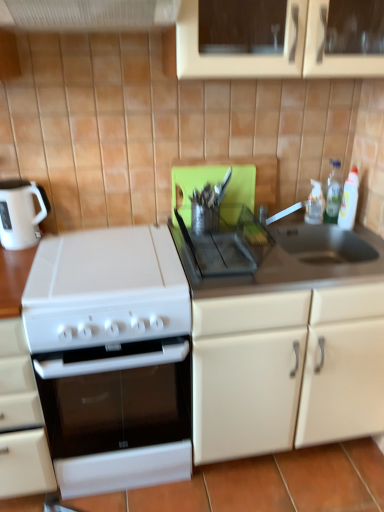
In order to face black plastic tray at center, the second gas stove positioned from the bottom, should I rotate leftwards or rightwards?

It's best to rotate right around 3.422 degrees.

This screenshot has height=512, width=384. Identify the location of clear plastic bottle at upper right, which ranks as the 2th bottle in right-to-left order. [315, 204].

Is white glossy gas stove at left, which ranks as the first gas stove in bottom-to-top order, a part of white plastic exhaust hood at upper center?

No, white glossy gas stove at left, which ranks as the first gas stove in bottom-to-top order, is not surrounded by white plastic exhaust hood at upper center.

From a real-world perspective, between white plastic exhaust hood at upper center and white glossy gas stove at left, the first gas stove when ordered from left to right, who is vertically higher?

white plastic exhaust hood at upper center, from a real-world perspective.

You are a GUI agent. You are given a task and a screenshot of the screen. Output one action in this format:
    pyautogui.click(x=<x>, y=<y>)
    Task: Click on the exhaust hood that is in front of the white glossy gas stove at left, the second gas stove positioned from the top
    This screenshot has height=512, width=384.
    Given the screenshot: What is the action you would take?
    pyautogui.click(x=88, y=14)

Would you say clear plastic bottle at upper right, which ranks as the 2th bottle in right-to-left order, is a long distance from white glossy gas stove at left, which ranks as the 2th gas stove in right-to-left order?

Yes, clear plastic bottle at upper right, which ranks as the 2th bottle in right-to-left order, and white glossy gas stove at left, which ranks as the 2th gas stove in right-to-left order, are quite far apart.

Considering the relative sizes of clear plastic bottle at upper right, which ranks as the 2th bottle in right-to-left order, and white glossy gas stove at left, the second gas stove positioned from the top, in the image provided, is clear plastic bottle at upper right, which ranks as the 2th bottle in right-to-left order, thinner than white glossy gas stove at left, the second gas stove positioned from the top,?

Yes.

Is clear plastic bottle at upper right, which ranks as the 2th bottle in right-to-left order, behind white glossy gas stove at left, the second gas stove positioned from the top?

Yes.

Which bottle is the 1st one when counting from the right side of the white glossy gas stove at left, which ranks as the first gas stove in bottom-to-top order? Please provide its 2D coordinates.

[(315, 204)]

Where is `the 1st bottle to the right when counting from the white glossy gas stove at left, which ranks as the 2th gas stove in right-to-left order`? the 1st bottle to the right when counting from the white glossy gas stove at left, which ranks as the 2th gas stove in right-to-left order is located at coordinates (315, 204).

Could you measure the distance between white glossy gas stove at left, the second gas stove positioned from the top, and clear plastic bottle at upper right, the first bottle when ordered from left to right?

They are 1.01 meters apart.

From a real-world perspective, which is physically below, white glossy gas stove at left, the first gas stove when ordered from left to right, or clear plastic bottle at upper right, the first bottle when ordered from left to right?

white glossy gas stove at left, the first gas stove when ordered from left to right, is physically lower.

Is point (133, 332) closer or farther from the camera than point (316, 197)?

Point (133, 332) is positioned closer to the camera compared to point (316, 197).

Where is `the 2nd bottle counting from the right side of the white matte oven at lower left, the 1th cabinetry viewed from the left`? The height and width of the screenshot is (512, 384). the 2nd bottle counting from the right side of the white matte oven at lower left, the 1th cabinetry viewed from the left is located at coordinates (349, 201).

Between white plastic bottle at upper right, the first bottle in the right-to-left sequence, and white matte oven at lower left, the 1th cabinetry viewed from the left, which one has smaller width?

white plastic bottle at upper right, the first bottle in the right-to-left sequence.

From a real-world perspective, which object rests below the other?

white matte oven at lower left, the 1th cabinetry viewed from the left.

From the image's perspective, which is below, white plastic bottle at upper right, the first bottle in the right-to-left sequence, or white plastic exhaust hood at upper center?

white plastic bottle at upper right, the first bottle in the right-to-left sequence, is shown below in the image.

Is white plastic bottle at upper right, the first bottle in the right-to-left sequence, not near white plastic exhaust hood at upper center?

Absolutely, white plastic bottle at upper right, the first bottle in the right-to-left sequence, is distant from white plastic exhaust hood at upper center.

Considering the positions of point (357, 198) and point (2, 5), is point (357, 198) closer or farther from the camera than point (2, 5)?

Point (357, 198) is positioned farther from the camera compared to point (2, 5).

How different are the orientations of white plastic bottle at upper right, the first bottle in the right-to-left sequence, and white plastic exhaust hood at upper center in degrees?

0.372 degrees.

Is white plastic exhaust hood at upper center inside white matte cabinet at right, marked as the 2th cabinetry in a left-to-right arrangement?

No, white plastic exhaust hood at upper center is located outside of white matte cabinet at right, marked as the 2th cabinetry in a left-to-right arrangement.

Are white matte cabinet at right, marked as the 2th cabinetry in a left-to-right arrangement, and white plastic exhaust hood at upper center beside each other?

No, white matte cabinet at right, marked as the 2th cabinetry in a left-to-right arrangement, is not with white plastic exhaust hood at upper center.

How far apart are white matte cabinet at right, marked as the 2th cabinetry in a left-to-right arrangement, and white plastic exhaust hood at upper center?

white matte cabinet at right, marked as the 2th cabinetry in a left-to-right arrangement, is 3.75 feet from white plastic exhaust hood at upper center.

Which of these two, white matte cabinet at right, positioned as the 1th cabinetry in right-to-left order, or white plastic exhaust hood at upper center, stands taller?

With more height is white matte cabinet at right, positioned as the 1th cabinetry in right-to-left order.

How many degrees apart are the facing directions of white glossy gas stove at left, which ranks as the 2th gas stove in right-to-left order, and white plastic exhaust hood at upper center?

0.372 degrees.

Is point (73, 377) farther from camera compared to point (12, 18)?

That is True.

In the scene shown: Is white glossy gas stove at left, the first gas stove when ordered from left to right, bigger than white plastic exhaust hood at upper center?

Correct, white glossy gas stove at left, the first gas stove when ordered from left to right, is larger in size than white plastic exhaust hood at upper center.

Is white glossy gas stove at left, the second gas stove positioned from the top, placed right next to white plastic exhaust hood at upper center?

There is a gap between white glossy gas stove at left, the second gas stove positioned from the top, and white plastic exhaust hood at upper center.

You are a GUI agent. You are given a task and a screenshot of the screen. Output one action in this format:
    pyautogui.click(x=<x>, y=<y>)
    Task: Click on the gas stove that is the 1st object to the right of the white plastic exhaust hood at upper center, starting at the anchor
    This screenshot has width=384, height=512.
    Given the screenshot: What is the action you would take?
    pyautogui.click(x=112, y=357)

The image size is (384, 512). Find the location of `the 2nd gas stove located beneath the clear plastic bottle at upper right, the first bottle when ordered from left to right (from a real-world perspective)`. the 2nd gas stove located beneath the clear plastic bottle at upper right, the first bottle when ordered from left to right (from a real-world perspective) is located at coordinates (112, 357).

From the picture: Estimate the real-world distances between objects in this image. Which object is closer to white matte oven at lower left, the 1th cabinetry viewed from the left, white plastic exhaust hood at upper center or white glossy gas stove at left, which ranks as the 2th gas stove in right-to-left order?

white glossy gas stove at left, which ranks as the 2th gas stove in right-to-left order, lies closer to white matte oven at lower left, the 1th cabinetry viewed from the left, than the other object.

From the image, which object appears to be farther from white plastic exhaust hood at upper center, clear plastic bottle at upper right, the first bottle when ordered from left to right, or white matte oven at lower left, the 2th cabinetry when ordered from right to left?

clear plastic bottle at upper right, the first bottle when ordered from left to right, lies further to white plastic exhaust hood at upper center than the other object.

Looking at the image, which one is located further to white plastic exhaust hood at upper center, white glossy gas stove at left, which ranks as the 2th gas stove in right-to-left order, or clear plastic bottle at upper right, which ranks as the 2th bottle in right-to-left order?

Among the two, clear plastic bottle at upper right, which ranks as the 2th bottle in right-to-left order, is located further to white plastic exhaust hood at upper center.

Estimate the real-world distances between objects in this image. Which object is closer to clear plastic bottle at upper right, which ranks as the 2th bottle in right-to-left order, white glossy gas stove at left, the first gas stove when ordered from left to right, or white glossy electric kettle at left?

Based on the image, white glossy gas stove at left, the first gas stove when ordered from left to right, appears to be nearer to clear plastic bottle at upper right, which ranks as the 2th bottle in right-to-left order.

From the image, which object appears to be nearer to clear plastic bottle at upper right, the first bottle when ordered from left to right, black plastic tray at center, the second gas stove in the left-to-right sequence, or white plastic exhaust hood at upper center?

Among the two, black plastic tray at center, the second gas stove in the left-to-right sequence, is located nearer to clear plastic bottle at upper right, the first bottle when ordered from left to right.

Looking at the image, which one is located further to white matte oven at lower left, the 2th cabinetry when ordered from right to left, white glossy electric kettle at left or white glossy gas stove at left, the second gas stove positioned from the top?

Based on the image, white glossy electric kettle at left appears to be further to white matte oven at lower left, the 2th cabinetry when ordered from right to left.

Which object lies further to the anchor point white plastic exhaust hood at upper center, white plastic bottle at upper right, the first bottle in the right-to-left sequence, or white glossy electric kettle at left?

Among the two, white plastic bottle at upper right, the first bottle in the right-to-left sequence, is located further to white plastic exhaust hood at upper center.

Looking at the image, which one is located further to black plastic tray at center, the second gas stove in the left-to-right sequence, clear plastic bottle at upper right, the first bottle when ordered from left to right, or white matte oven at lower left, the 2th cabinetry when ordered from right to left?

white matte oven at lower left, the 2th cabinetry when ordered from right to left, is positioned further to the anchor black plastic tray at center, the second gas stove in the left-to-right sequence.

I want to click on kitchen appliance situated between white matte oven at lower left, the 2th cabinetry when ordered from right to left, and white plastic bottle at upper right, the first bottle in the right-to-left sequence, from left to right, so click(21, 213).

Locate an element on the screen. The width and height of the screenshot is (384, 512). gas stove between clear plastic bottle at upper right, the first bottle when ordered from left to right, and white matte cabinet at right, marked as the 2th cabinetry in a left-to-right arrangement, in the vertical direction is located at coordinates (227, 243).

Locate an element on the screen. Image resolution: width=384 pixels, height=512 pixels. gas stove that lies between white plastic exhaust hood at upper center and white glossy gas stove at left, which ranks as the 2th gas stove in right-to-left order, from top to bottom is located at coordinates (227, 243).

Where is `bottle located between white glossy electric kettle at left and white plastic bottle at upper right, the first bottle in the right-to-left sequence, in the left-right direction`? This screenshot has width=384, height=512. bottle located between white glossy electric kettle at left and white plastic bottle at upper right, the first bottle in the right-to-left sequence, in the left-right direction is located at coordinates (315, 204).